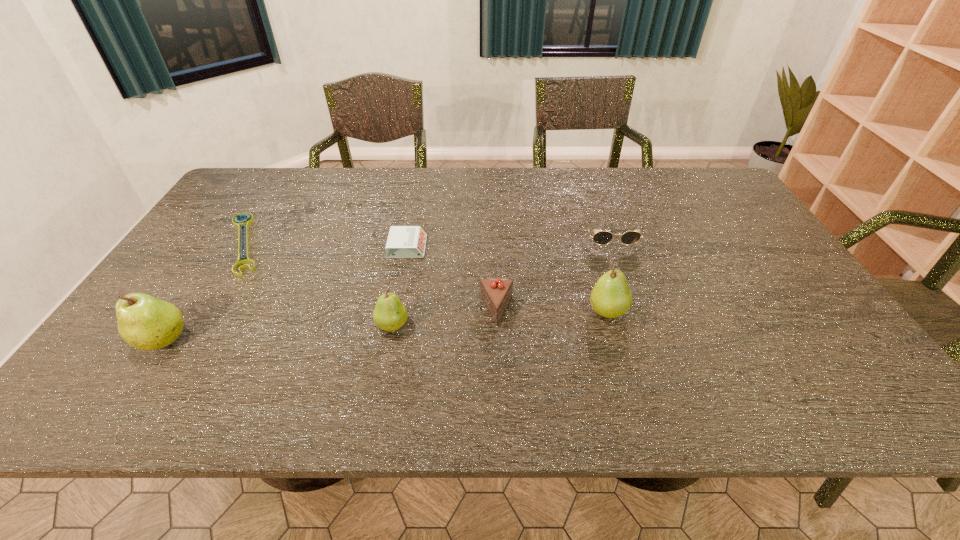
Locate an element on the screen. vacant space located 0.170m on the right of the tallest pear is located at coordinates (263, 340).

At what (x,y) coordinates should I click in order to perform the action: click on vacant space located 0.360m on the back of the shortest pear. Please return your answer as a coordinate pair (x, y). The height and width of the screenshot is (540, 960). Looking at the image, I should click on (412, 226).

This screenshot has width=960, height=540. What are the coordinates of `vacant space located 0.220m on the left of the second tallest object` in the screenshot? It's located at (498, 311).

Where is `free location located on the right of the shortest object`? This screenshot has height=540, width=960. free location located on the right of the shortest object is located at coordinates (335, 244).

Locate an element on the screen. vacant region located on the right of the sixth tallest object is located at coordinates (555, 247).

This screenshot has height=540, width=960. In order to click on free space located 0.400m on the front lenses of the sunglasses in this screenshot , I will do click(x=654, y=368).

You are a GUI agent. You are given a task and a screenshot of the screen. Output one action in this format:
    pyautogui.click(x=<x>, y=<y>)
    Task: Click on the free space located 0.090m on the back of the third object from right to left
    
    Given the screenshot: What is the action you would take?
    pyautogui.click(x=495, y=271)

At what (x,y) coordinates should I click in order to perform the action: click on pear that is positioned at the left edge. Please return your answer as a coordinate pair (x, y). The width and height of the screenshot is (960, 540). Looking at the image, I should click on (146, 323).

Find the location of a particular element. Image resolution: width=960 pixels, height=540 pixels. wrench located at the left edge is located at coordinates (244, 224).

This screenshot has width=960, height=540. In order to click on object situated at the near left corner in this screenshot , I will do `click(146, 323)`.